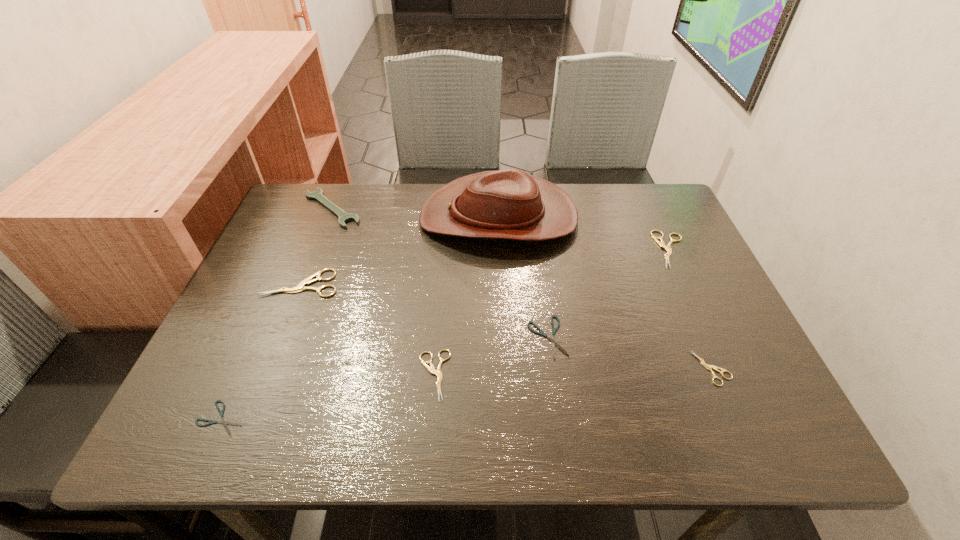
Where is `vacant area that lies between the tallest object and the third shears from right to left`? This screenshot has height=540, width=960. vacant area that lies between the tallest object and the third shears from right to left is located at coordinates coord(523,278).

At what (x,y) coordinates should I click in order to perform the action: click on free space between the tallest object and the second tallest shears. Please return your answer as a coordinate pair (x, y). The height and width of the screenshot is (540, 960). Looking at the image, I should click on (585, 233).

Where is `unoccupied position between the third biggest beige shears and the smallest beige shears`? This screenshot has width=960, height=540. unoccupied position between the third biggest beige shears and the smallest beige shears is located at coordinates (573, 372).

At what (x,y) coordinates should I click in order to perform the action: click on free space between the fourth shears from left to right and the third shears from left to right. Please return your answer as a coordinate pair (x, y). The width and height of the screenshot is (960, 540). Looking at the image, I should click on (491, 356).

Find the location of a particular element. Image resolution: width=960 pixels, height=540 pixels. free space that is in between the fifth tallest object and the shortest shears is located at coordinates (327, 397).

You are a GUI agent. You are given a task and a screenshot of the screen. Output one action in this format:
    pyautogui.click(x=<x>, y=<y>)
    Task: Click on the free point between the brown cowboy hat and the smallest beige shears
    
    Given the screenshot: What is the action you would take?
    pyautogui.click(x=605, y=293)

Where is `unoccupied area between the wrench and the smallest beige shears`? This screenshot has height=540, width=960. unoccupied area between the wrench and the smallest beige shears is located at coordinates (521, 288).

Select which object is the fourth closest to the leftmost beige shears. Please provide its 2D coordinates. Your answer should be formatted as a tuple, i.e. [(x, y)], where the tuple contains the x and y coordinates of a point satisfying the conditions above.

[(222, 421)]

Identify which object is the fifth closest to the wrench. Please provide its 2D coordinates. Your answer should be formatted as a tuple, i.e. [(x, y)], where the tuple contains the x and y coordinates of a point satisfying the conditions above.

[(552, 339)]

Identify which shears is the fourth closest to the farther black shears. Please provide its 2D coordinates. Your answer should be formatted as a tuple, i.e. [(x, y)], where the tuple contains the x and y coordinates of a point satisfying the conditions above.

[(300, 287)]